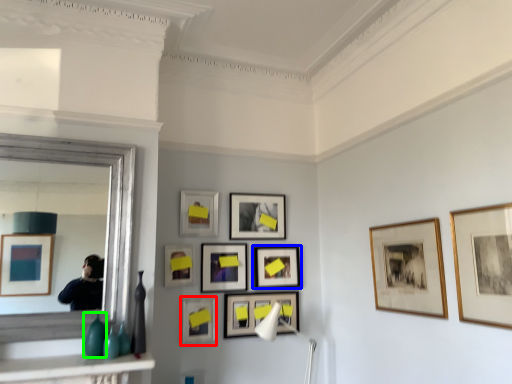
Question: Considering the real-world distances, which object is farthest from picture frame (highlighted by a red box)? picture frame (highlighted by a blue box) or glass vase (highlighted by a green box)?

Choices:
 (A) picture frame
 (B) glass vase

Answer: (B)